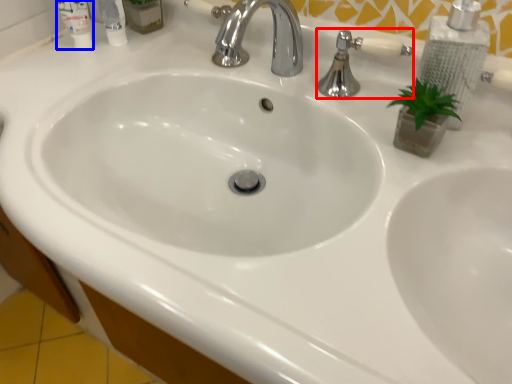
Question: Which object is closer to the camera taking this photo, plumbing fixture (highlighted by a red box) or mouthwash (highlighted by a blue box)?

Choices:
 (A) plumbing fixture
 (B) mouthwash

Answer: (A)